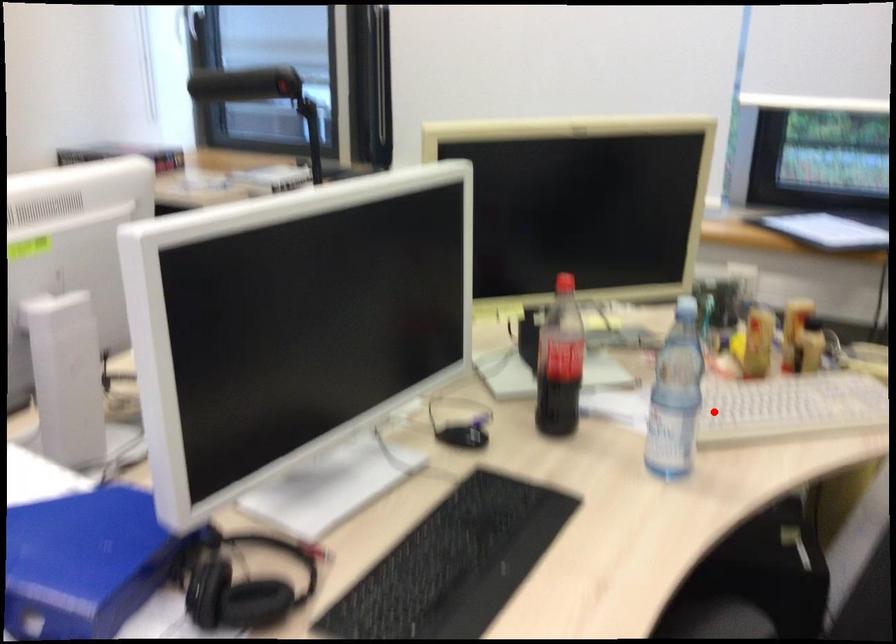
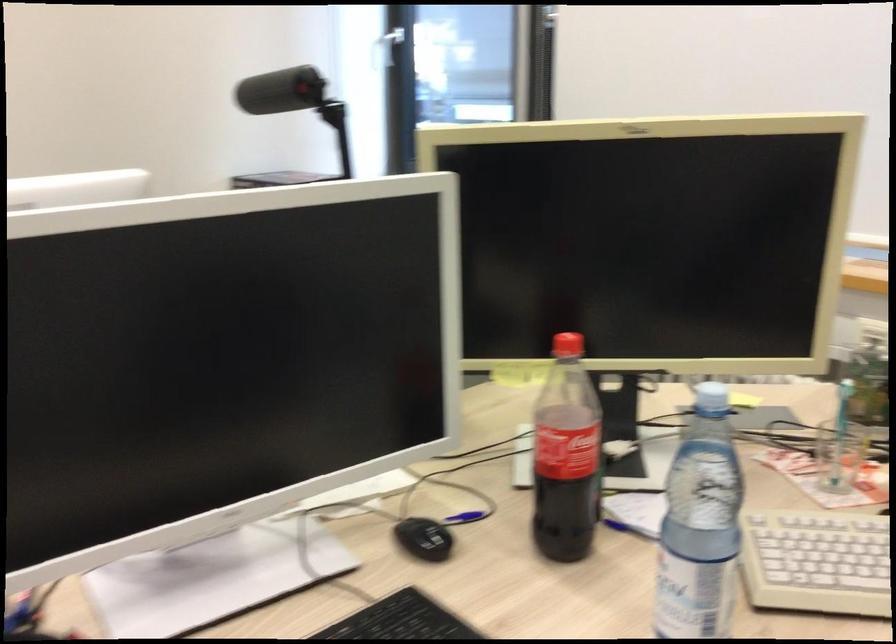
Where in the second image is the point corresponding to the highlighted location from the first image?

(815, 562)